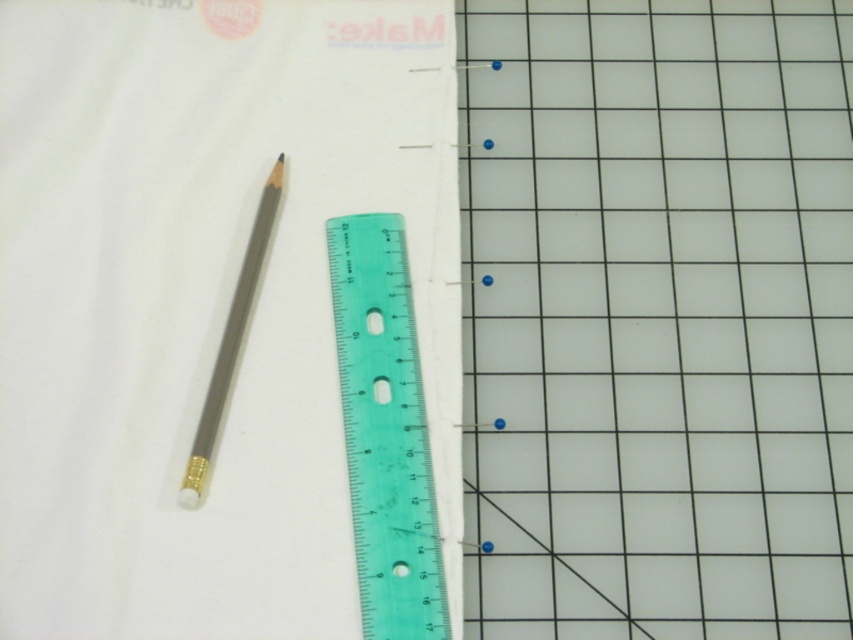
Question: Where is transparent plastic grid at center located in relation to matte gray pencil at center-left in the image?

Choices:
 (A) below
 (B) above

Answer: (B)

Question: Which point is closer to the camera?

Choices:
 (A) matte gold eraser at lower left
 (B) matte gray pencil at center-left
 (C) white matte cloth at upper left
 (D) green plastic ruler at center-left

Answer: (C)

Question: Considering the real-world distances, which object is farthest from the transparent plastic grid at center?

Choices:
 (A) white matte cloth at upper left
 (B) matte gray pencil at center-left

Answer: (B)

Question: Which of the following is the closest to the observer?

Choices:
 (A) white matte cloth at upper left
 (B) matte gray pencil at center-left
 (C) green plastic ruler at center-left
 (D) matte gold eraser at lower left

Answer: (A)

Question: Is white matte cloth at upper left to the right of matte gold eraser at lower left from the viewer's perspective?

Choices:
 (A) yes
 (B) no

Answer: (A)

Question: Does white matte cloth at upper left appear under matte gold eraser at lower left?

Choices:
 (A) yes
 (B) no

Answer: (B)